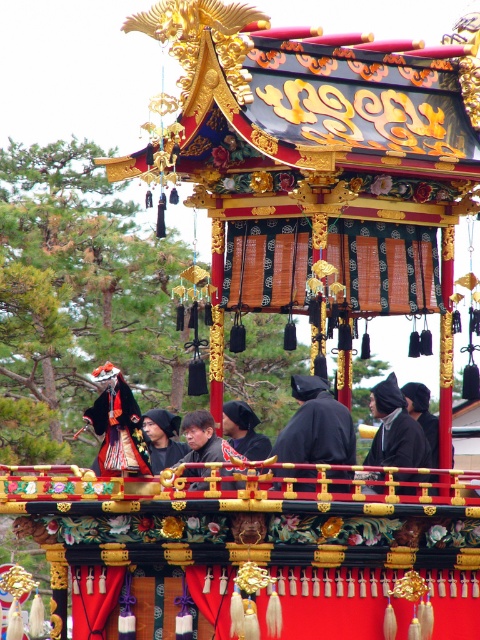
Question: Does black matte robe at center have a larger size compared to black matte clothing at center?

Choices:
 (A) no
 (B) yes

Answer: (A)

Question: Which of the following is the closest to the observer?

Choices:
 (A) (317, 400)
 (B) (155, 417)

Answer: (A)

Question: Does black matte robe at center have a larger size compared to matte black mask at center?

Choices:
 (A) yes
 (B) no

Answer: (A)

Question: Among these points, which one is farthest from the camera?

Choices:
 (A) (387, 417)
 (B) (181, 456)

Answer: (B)

Question: Which point is closer to the camera?

Choices:
 (A) (389, 392)
 (B) (288, 432)

Answer: (B)

Question: Can you confirm if black matte robe at center is positioned below matte black mask at center?

Choices:
 (A) no
 (B) yes

Answer: (A)